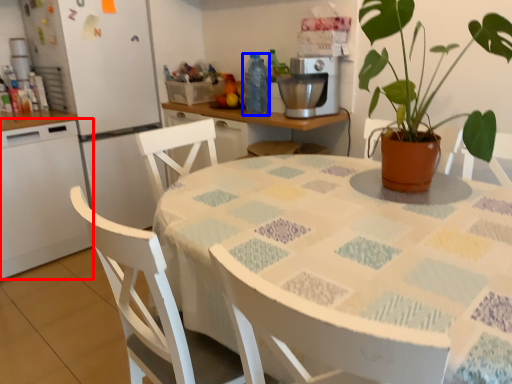
Question: Which of the following is the closest to the observer, kitchen appliance (highlighted by a red box) or bottle (highlighted by a blue box)?

Choices:
 (A) kitchen appliance
 (B) bottle

Answer: (A)